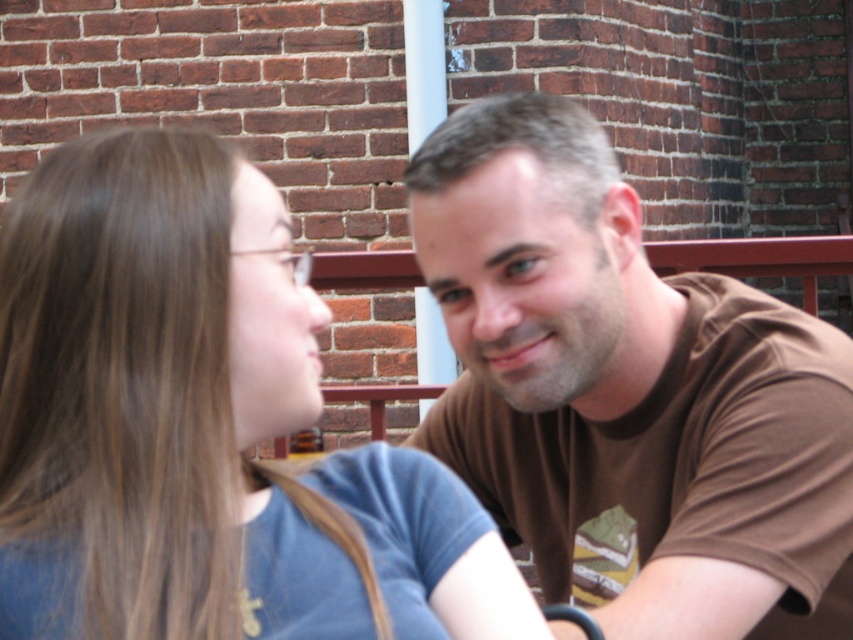
Question: Does brown cotton t-shirt at center have a lesser width compared to blue cotton shirt at center?

Choices:
 (A) yes
 (B) no

Answer: (B)

Question: Can you confirm if brown cotton t-shirt at center is positioned to the right of blue cotton shirt at center?

Choices:
 (A) no
 (B) yes

Answer: (B)

Question: Does brown cotton t-shirt at center have a smaller size compared to blue cotton shirt at center?

Choices:
 (A) no
 (B) yes

Answer: (A)

Question: Among these objects, which one is farthest from the camera?

Choices:
 (A) blue cotton shirt at center
 (B) brown cotton t-shirt at center

Answer: (B)

Question: Which of the following is the farthest from the observer?

Choices:
 (A) blue cotton shirt at center
 (B) brown cotton t-shirt at center

Answer: (B)